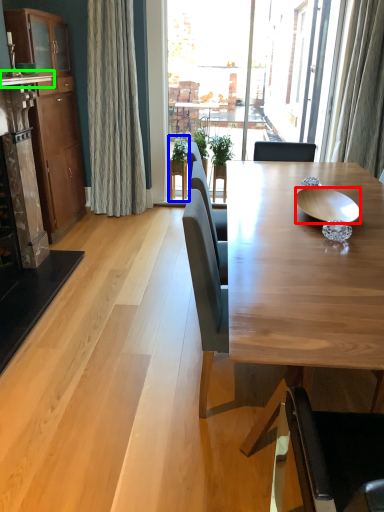
Question: Which object is positioned farthest from bowl (highlighted by a red box)? Select from houseplant (highlighted by a blue box) and counter top (highlighted by a green box).

Choices:
 (A) houseplant
 (B) counter top

Answer: (A)